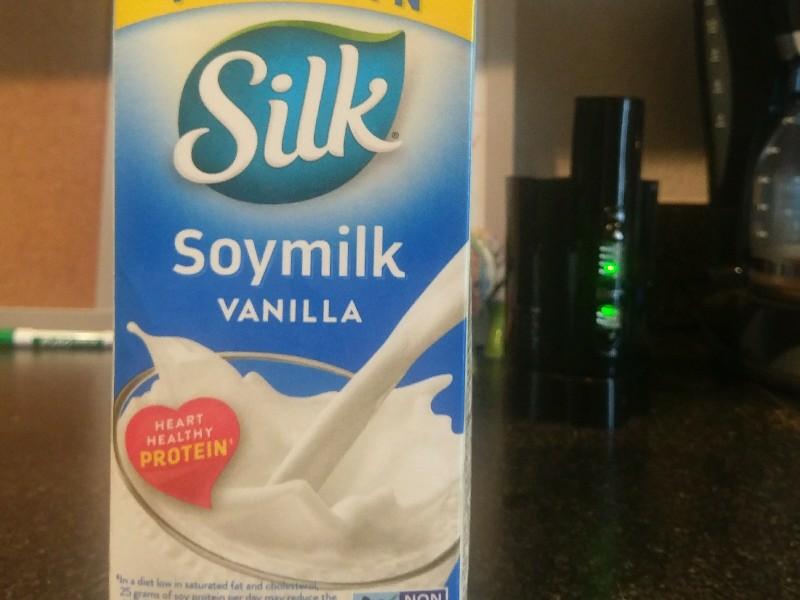
In order to click on glass in this screenshot , I will do `click(284, 370)`, `click(120, 468)`, `click(138, 379)`, `click(433, 560)`.